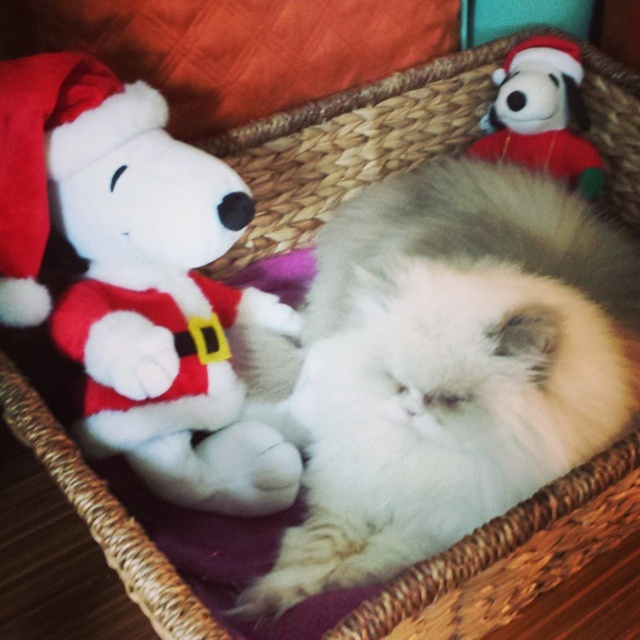
Find the location of a particular element. This screenshot has height=640, width=640. white plush toy at left is located at coordinates (138, 280).

Is point (205, 328) closer to camera compared to point (513, 112)?

Yes, point (205, 328) is closer to viewer.

Locate an element on the screen. This screenshot has height=640, width=640. white plush toy at left is located at coordinates (138, 280).

Where is `white plush toy at left`? This screenshot has height=640, width=640. white plush toy at left is located at coordinates point(138,280).